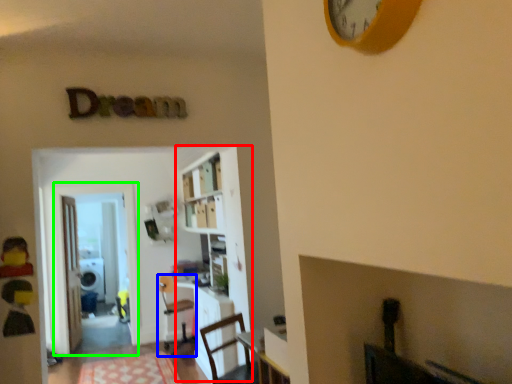
Question: Considering the real-world distances, which object is closest to bookcase (highlighted by a red box)? chair (highlighted by a blue box) or glass door (highlighted by a green box).

Choices:
 (A) chair
 (B) glass door

Answer: (A)